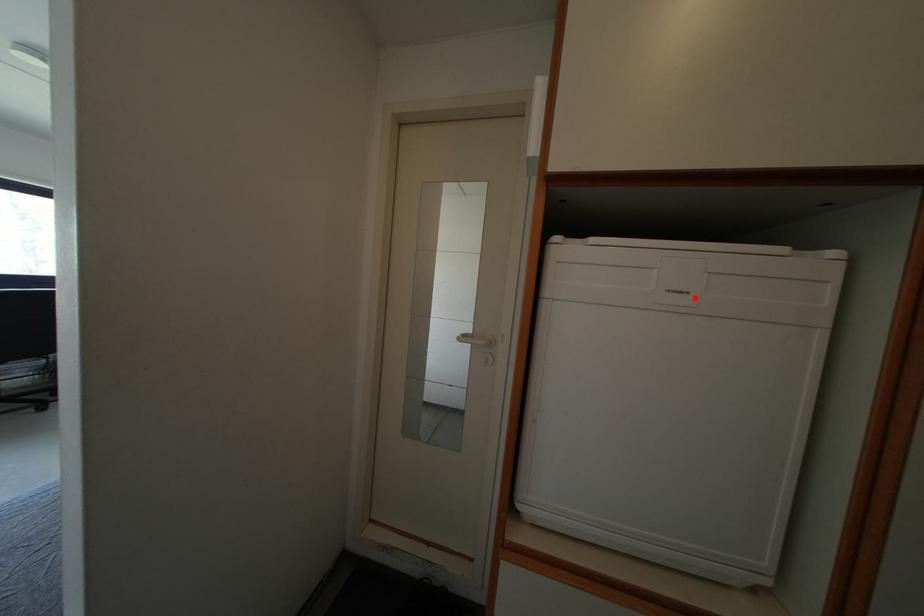
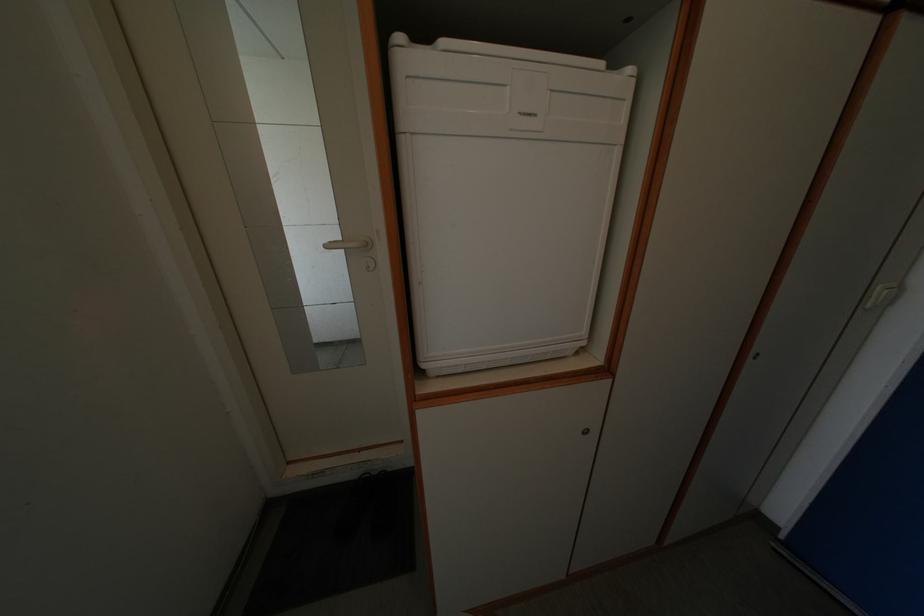
Find the pixel in the second image that matches the highlighted location in the first image.

(542, 120)